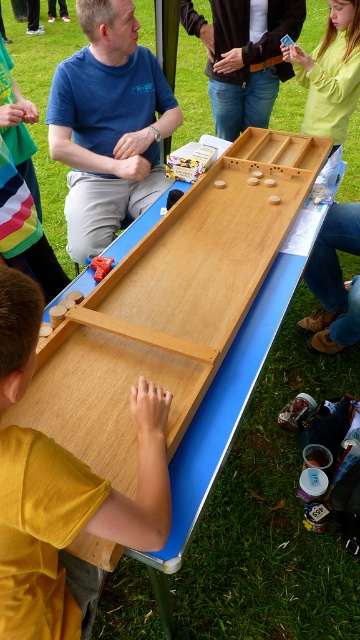
Does denim jeans at center have a greater height compared to wooden game board at center?

Indeed, denim jeans at center has a greater height compared to wooden game board at center.

Consider the image. Can you confirm if denim jeans at center is bigger than wooden game board at center?

Yes, denim jeans at center is bigger than wooden game board at center.

Identify the location of denim jeans at center. (243, 58).

I want to click on denim jeans at center, so click(243, 58).

Can you confirm if wooden board game at lower left is smaller than wooden game board at center?

Incorrect, wooden board game at lower left is not smaller in size than wooden game board at center.

The height and width of the screenshot is (640, 360). Find the location of `wooden board game at lower left`. wooden board game at lower left is located at coordinates (70, 516).

Between wooden board game at lower left and matte blue shirt at upper left, which one has less height?

wooden board game at lower left

Is wooden board game at lower left smaller than matte blue shirt at upper left?

Correct, wooden board game at lower left occupies less space than matte blue shirt at upper left.

Image resolution: width=360 pixels, height=640 pixels. What do you see at coordinates (70, 516) in the screenshot? I see `wooden board game at lower left` at bounding box center [70, 516].

Identify the location of wooden board game at lower left. (70, 516).